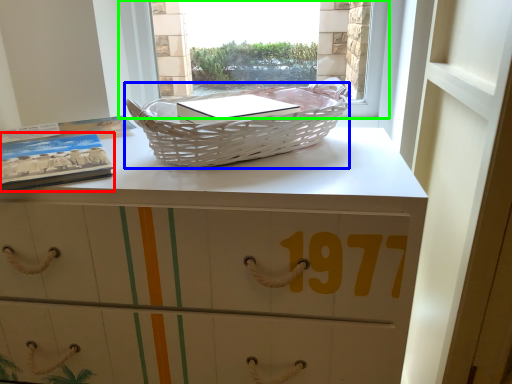
Question: Estimate the real-world distances between objects in this image. Which object is closer to paperback book (highlighted by a red box), picnic basket (highlighted by a blue box) or window (highlighted by a green box)?

Choices:
 (A) picnic basket
 (B) window

Answer: (A)